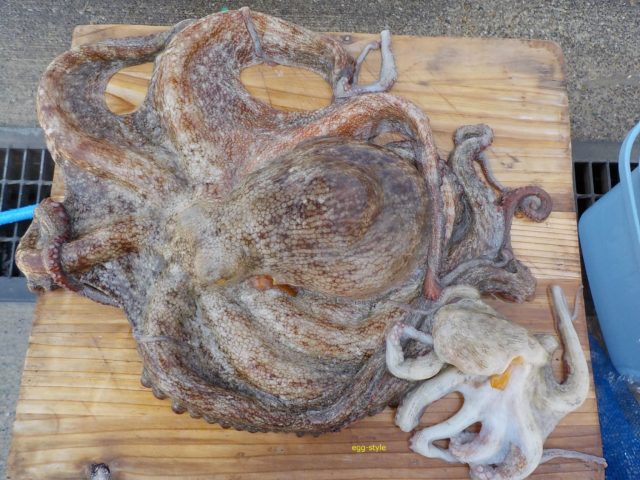
I want to click on metal vent, so click(18, 164).